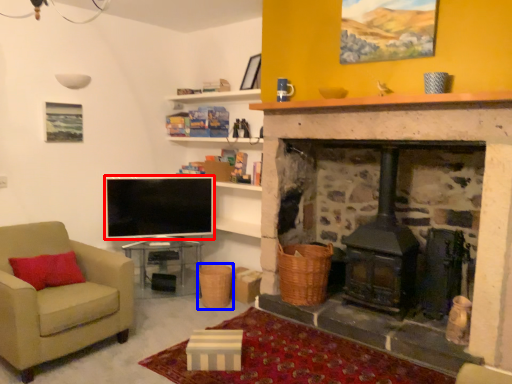
Question: Among these objects, which one is farthest to the camera, television (highlighted by a red box) or basket (highlighted by a blue box)?

Choices:
 (A) television
 (B) basket

Answer: (A)